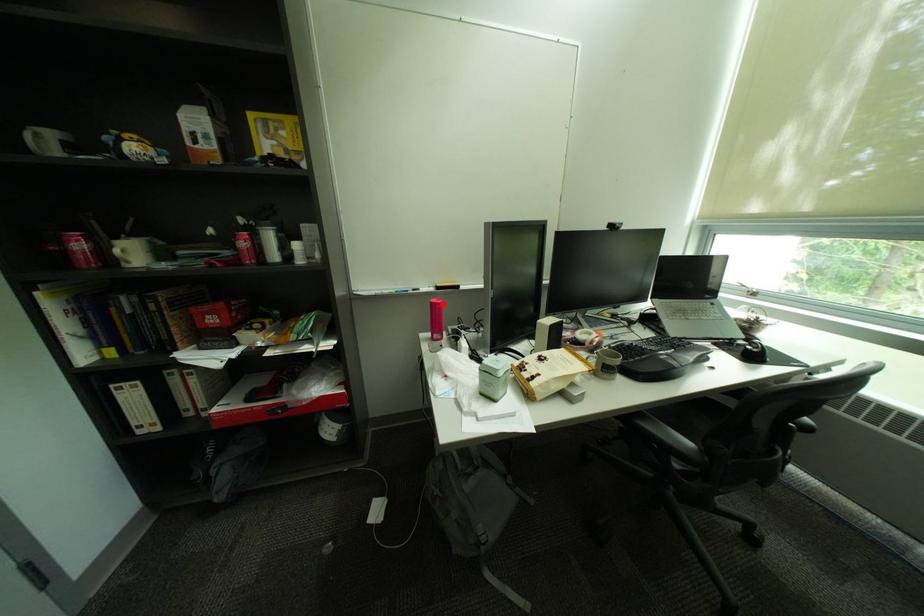
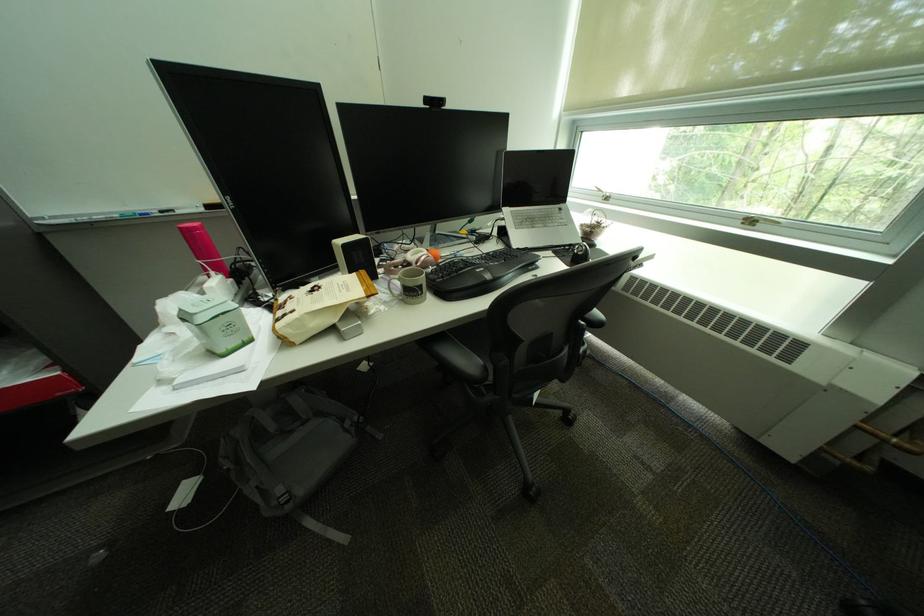
In the second image, find the point that corresponds to the highlighted location in the first image.

(190, 230)